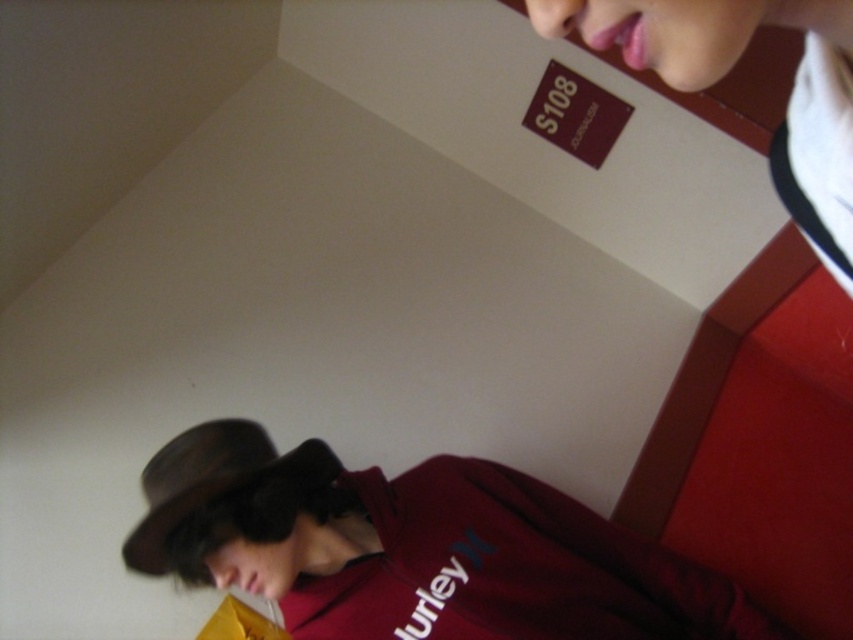
Who is shorter, matte maroon hoodie at lower right or brown felt fedora at lower left?

brown felt fedora at lower left is shorter.

Based on the photo, is matte maroon hoodie at lower right above brown felt fedora at lower left?

No, matte maroon hoodie at lower right is not above brown felt fedora at lower left.

Describe the element at coordinates (415, 548) in the screenshot. I see `matte maroon hoodie at lower right` at that location.

Find the location of a particular element. This screenshot has width=853, height=640. matte maroon hoodie at lower right is located at coordinates (415, 548).